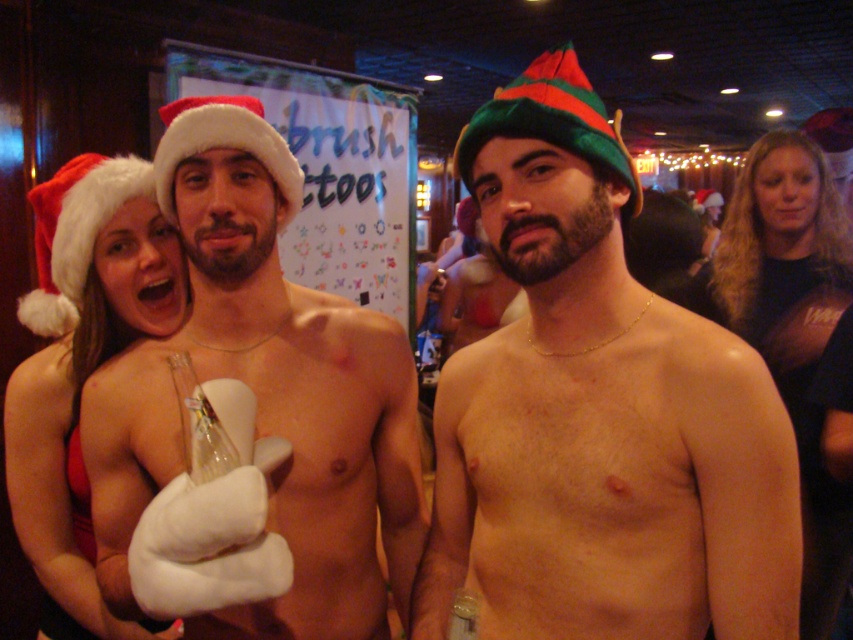
Is matte red santa hat at left wider than green felt christmas hat at center?

Correct, the width of matte red santa hat at left exceeds that of green felt christmas hat at center.

Is point (10, 413) less distant than point (463, 173)?

No, it is behind (463, 173).

Find the location of `matte red santa hat at left`. matte red santa hat at left is located at coordinates (80, 368).

Which of these two, shiny metallic hat at center or white fluffy glove at center, stands taller?

white fluffy glove at center is taller.

Who is positioned more to the right, shiny metallic hat at center or white fluffy glove at center?

shiny metallic hat at center

I want to click on shiny metallic hat at center, so click(x=598, y=413).

Who is higher up, black matte shirt at upper right or green felt christmas hat at center?

green felt christmas hat at center is higher up.

What do you see at coordinates (790, 326) in the screenshot? I see `black matte shirt at upper right` at bounding box center [790, 326].

Describe the element at coordinates (790, 326) in the screenshot. I see `black matte shirt at upper right` at that location.

Locate an element on the screen. black matte shirt at upper right is located at coordinates (790, 326).